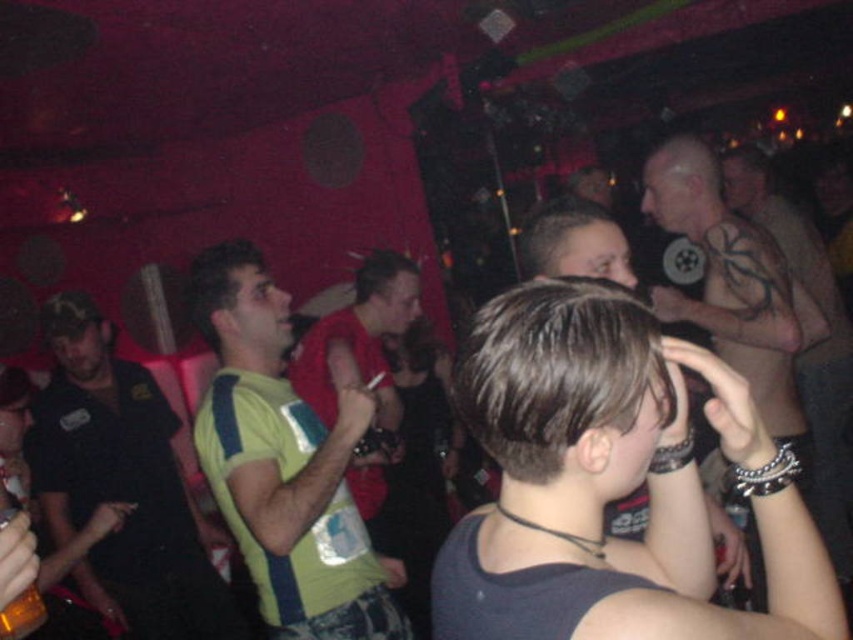
Question: Which point is closer to the camera taking this photo?

Choices:
 (A) (587, 561)
 (B) (779, 342)
 (C) (372, 323)

Answer: (A)

Question: Can you confirm if green fabric shirt at center is positioned to the left of translucent amber liquid at lower left?

Choices:
 (A) yes
 (B) no

Answer: (B)

Question: Among these points, which one is farthest from the camera?

Choices:
 (A) (604, 321)
 (B) (779, 387)
 (C) (383, 490)

Answer: (C)

Question: Observing the image, what is the correct spatial positioning of green fabric shirt at center in reference to green fabric shirt at left?

Choices:
 (A) above
 (B) below

Answer: (A)

Question: Which object is positioned farthest from the red matte shirt at center?

Choices:
 (A) translucent amber liquid at lower left
 (B) shiny black tank top at upper right

Answer: (A)

Question: Observing the image, what is the correct spatial positioning of dark gray tank top at center in reference to shiny black tank top at upper right?

Choices:
 (A) below
 (B) above

Answer: (A)